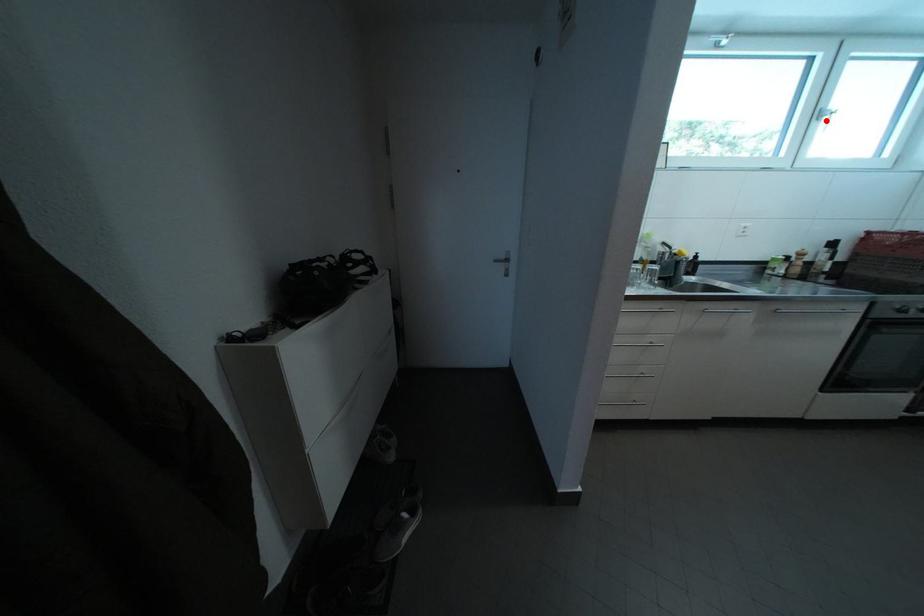
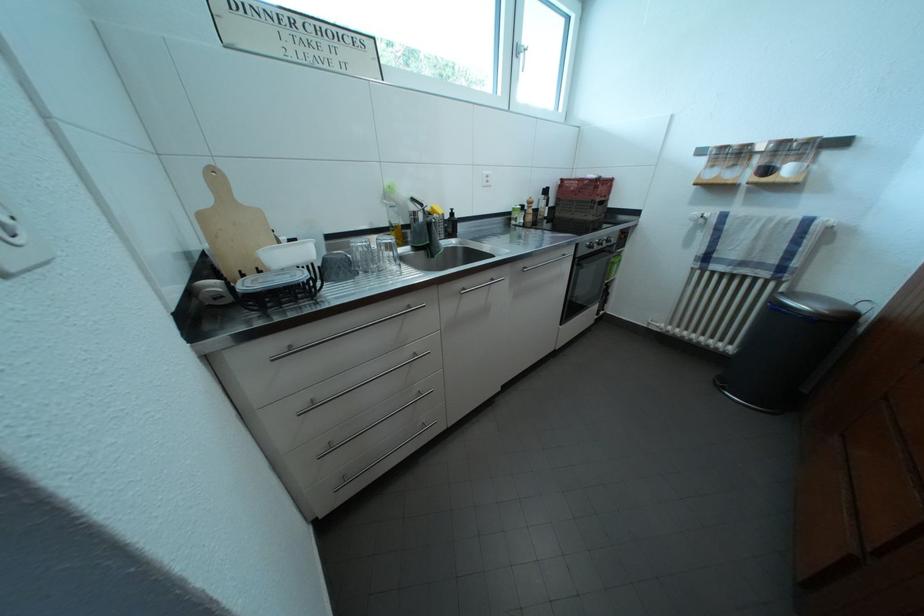
Question: I am providing you with two images of the same scene from different viewpoints. A red point is shown in image1. For the corresponding object point in image2, is it positioned nearer or farther from the camera?

Choices:
 (A) Nearer
 (B) Farther

Answer: (A)